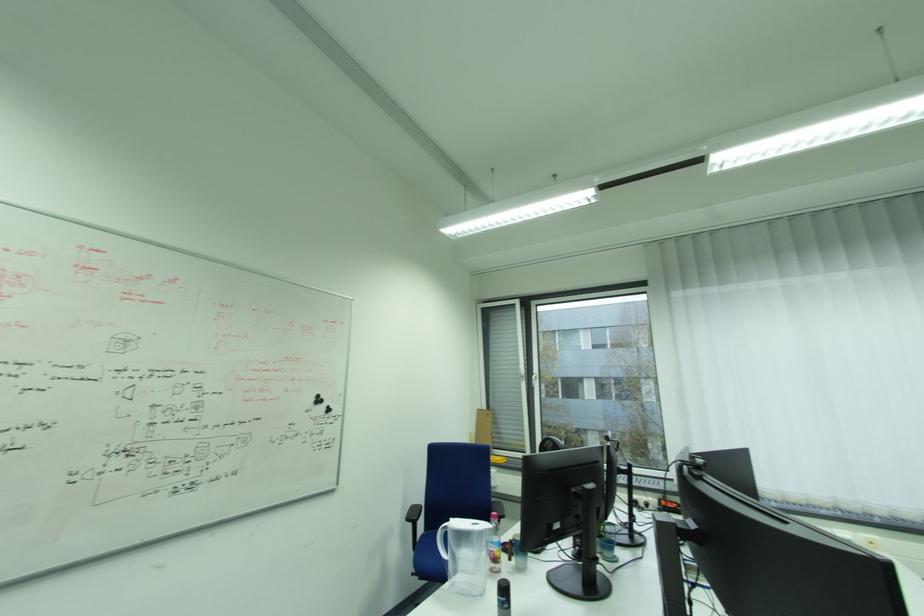
Where is `blue chair armrest`? Image resolution: width=924 pixels, height=616 pixels. blue chair armrest is located at coordinates (412, 516).